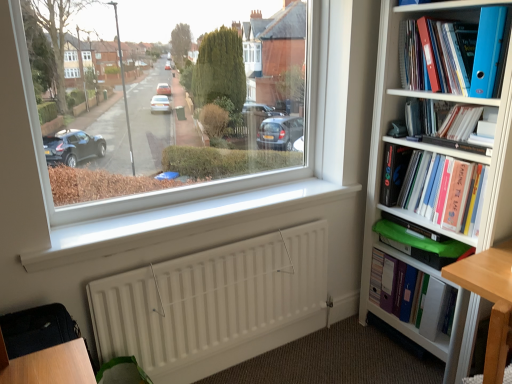
Question: Is blue plastic folder at upper right turned away from white matte radiator at lower center?

Choices:
 (A) yes
 (B) no

Answer: (B)

Question: Is blue plastic folder at upper right closer to the viewer compared to white matte radiator at lower center?

Choices:
 (A) no
 (B) yes

Answer: (B)

Question: From a real-world perspective, is blue plastic folder at upper right physically below white matte radiator at lower center?

Choices:
 (A) yes
 (B) no

Answer: (B)

Question: Are blue plastic folder at upper right and white matte radiator at lower center making contact?

Choices:
 (A) no
 (B) yes

Answer: (A)

Question: Could you tell me if blue plastic folder at upper right is turned towards white matte radiator at lower center?

Choices:
 (A) yes
 (B) no

Answer: (B)

Question: Is blue plastic folder at upper right taller than white matte radiator at lower center?

Choices:
 (A) yes
 (B) no

Answer: (B)

Question: Does blue plastic folder at upper right, which is counted as the first book, starting from the top, come behind white plastic shelf at lower right?

Choices:
 (A) no
 (B) yes

Answer: (A)

Question: From the image's perspective, is blue plastic folder at upper right, which is counted as the first book, starting from the top, on white plastic shelf at lower right?

Choices:
 (A) no
 (B) yes

Answer: (B)

Question: Is blue plastic folder at upper right, which is counted as the first book, starting from the top, outside white plastic shelf at lower right?

Choices:
 (A) yes
 (B) no

Answer: (A)

Question: Can you confirm if blue plastic folder at upper right, which is counted as the first book, starting from the top, is smaller than white plastic shelf at lower right?

Choices:
 (A) yes
 (B) no

Answer: (B)

Question: Can you confirm if blue plastic folder at upper right, which is counted as the first book, starting from the top, is taller than white plastic shelf at lower right?

Choices:
 (A) no
 (B) yes

Answer: (B)

Question: Is blue plastic folder at upper right, which ranks as the 4th book in bottom-to-top order, turned away from white plastic shelf at lower right?

Choices:
 (A) no
 (B) yes

Answer: (A)

Question: From the image's perspective, is hardcover book at upper right, placed as the third book when sorted from bottom to top, on white plastic shelf at lower right?

Choices:
 (A) yes
 (B) no

Answer: (A)